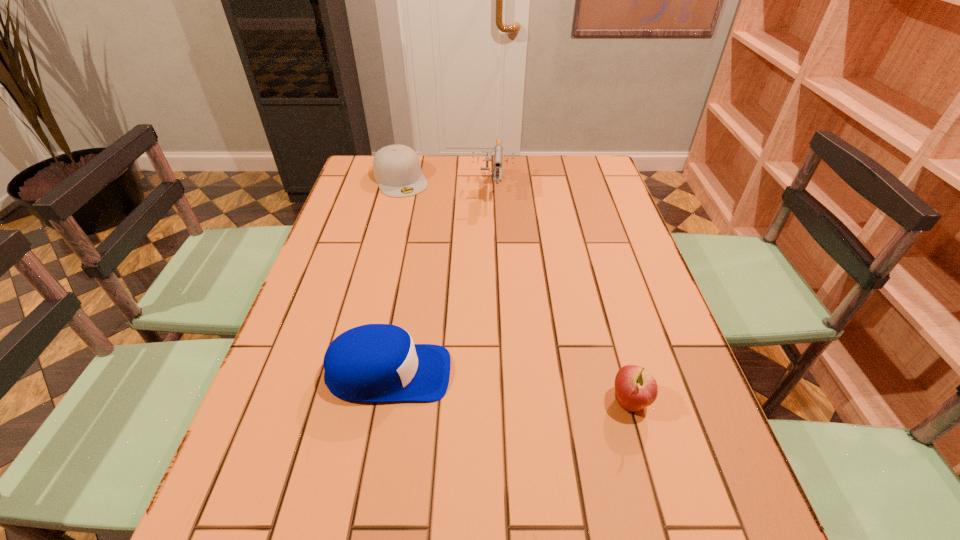
The height and width of the screenshot is (540, 960). I want to click on vacant space that's between the cap and the rightmost object, so click(x=516, y=291).

Image resolution: width=960 pixels, height=540 pixels. Identify the location of empty space between the cap and the baseball cap. (395, 276).

The image size is (960, 540). Identify the location of free space that is in between the baseball cap and the rightmost object. (509, 388).

Find the location of a particular element. This screenshot has height=540, width=960. vacant area between the baseball cap and the cap is located at coordinates (395, 276).

The height and width of the screenshot is (540, 960). Find the location of `free space between the cap and the apple`. free space between the cap and the apple is located at coordinates (516, 291).

Locate which object ranks in proximity to the baseball cap. Please provide its 2D coordinates. Your answer should be formatted as a tuple, i.e. [(x, y)], where the tuple contains the x and y coordinates of a point satisfying the conditions above.

[(635, 388)]

Identify which object is the third nearest to the baseball cap. Please provide its 2D coordinates. Your answer should be formatted as a tuple, i.e. [(x, y)], where the tuple contains the x and y coordinates of a point satisfying the conditions above.

[(397, 169)]

At what (x,y) coordinates should I click in order to perform the action: click on vacant point that satisfies the following two spatial constraints: 1. on the front side of the rightmost object; 2. on the left side of the third object from left to right. Please return your answer as a coordinate pair (x, y). This screenshot has width=960, height=540. Looking at the image, I should click on (500, 402).

Where is `free location that satisfies the following two spatial constraints: 1. on the front side of the baseball cap; 2. on the front-facing side of the cap`? free location that satisfies the following two spatial constraints: 1. on the front side of the baseball cap; 2. on the front-facing side of the cap is located at coordinates (352, 374).

At what (x,y) coordinates should I click in order to perform the action: click on free space that satisfies the following two spatial constraints: 1. on the front side of the apple; 2. on the right side of the cap. Please return your answer as a coordinate pair (x, y). This screenshot has height=540, width=960. Looking at the image, I should click on click(x=345, y=402).